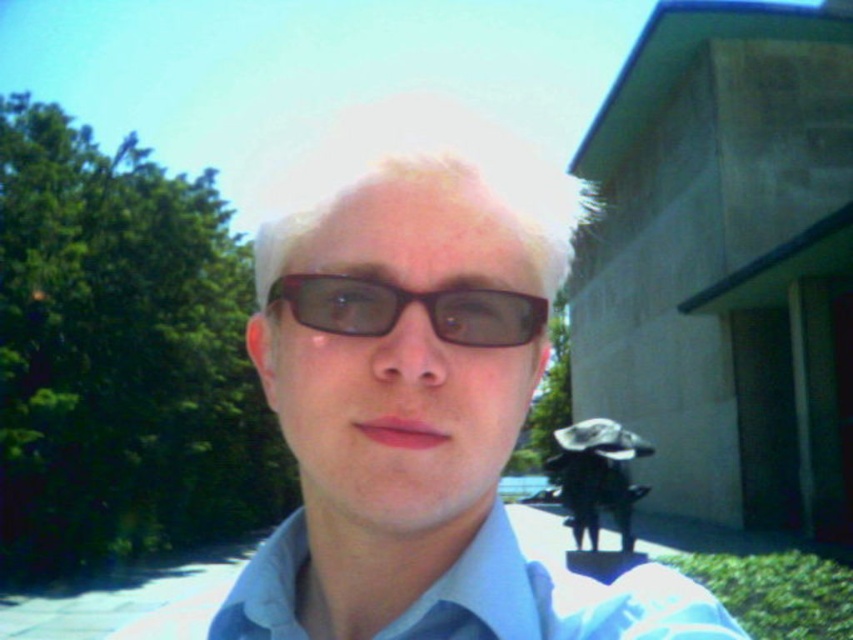
You are a photographer trying to capture a clear shot of the shiny brown glasses at center. However, the blonde hair at center is blocking your view. Can you adjust your angle to see the glasses without moving the subject?

The shiny brown glasses at center is behind blonde hair at center, so adjusting the angle might allow you to see around or through the hair to capture the glasses without moving the subject.

You are holding a camera and want to take a selfie with the matte brown glasses at center. The recommended distance for a clear selfie is 15 inches. Is your current distance sufficient?

The distance between you and the matte brown glasses at center is 15.16 inches, which is slightly more than the recommended 15 inches. Adjusting a bit closer would ensure a clearer image.

In the scene shown: You are a photographer trying to capture a closeup shot of the person in the scene. You have a camera with a 5 inch focus range. Can you focus on both the matte brown glasses at center and the white cotton dress shirt at center at the same time?

The matte brown glasses at center and white cotton dress shirt at center are 5.65 inches apart from each other. Since your camera has a 5 inch focus range, it cannot capture both objects simultaneously because the distance between them exceeds the focus range.